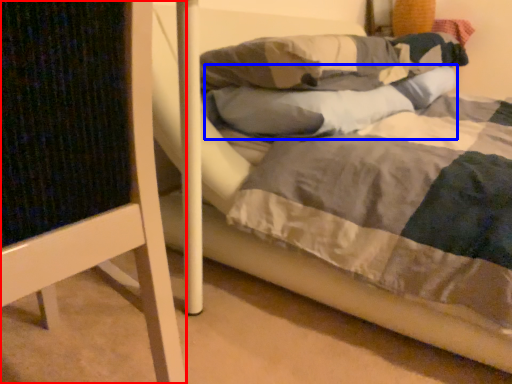
Question: Which point is closer to the camera, furniture (highlighted by a red box) or pillow (highlighted by a blue box)?

Choices:
 (A) furniture
 (B) pillow

Answer: (A)